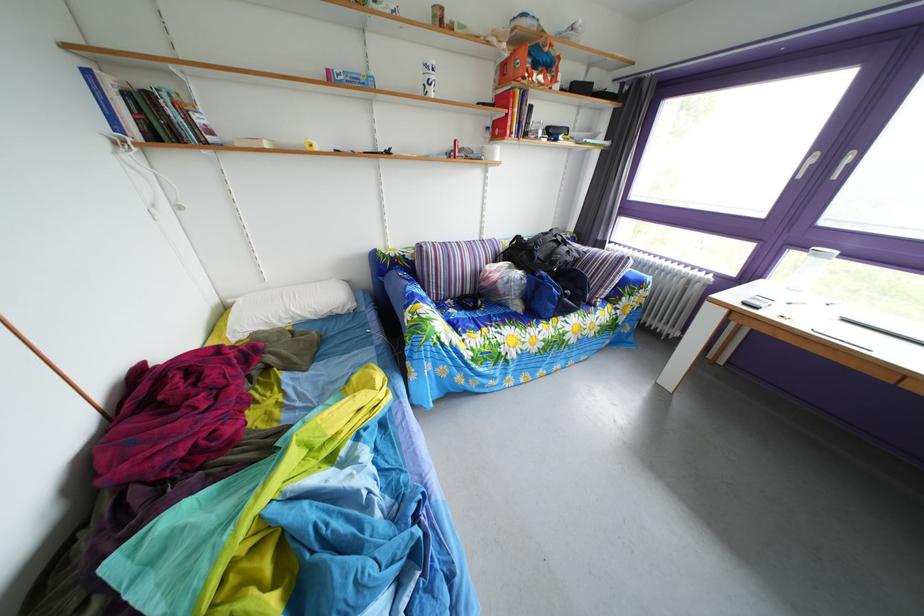
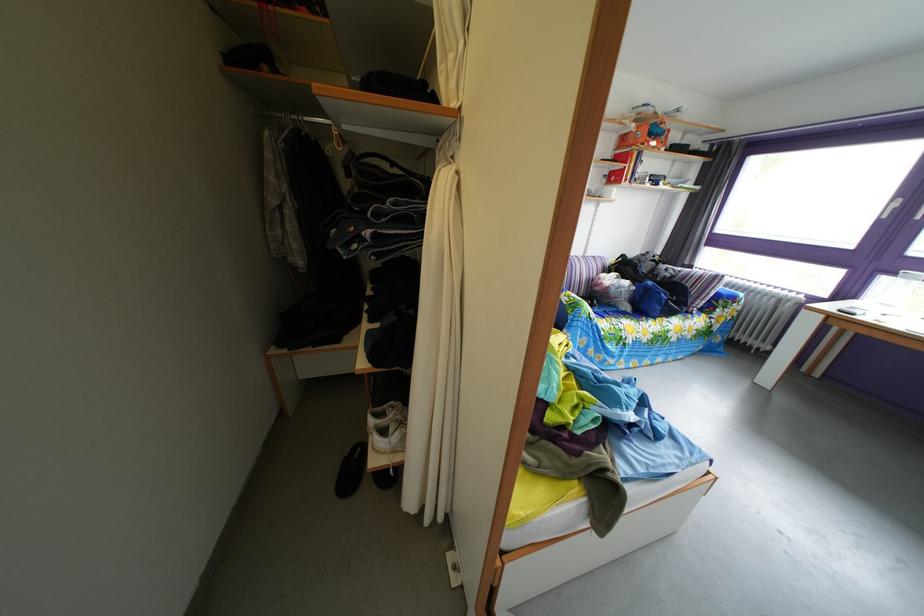
Where in the second image is the point corresponding to (492,241) from the first image?

(596, 261)